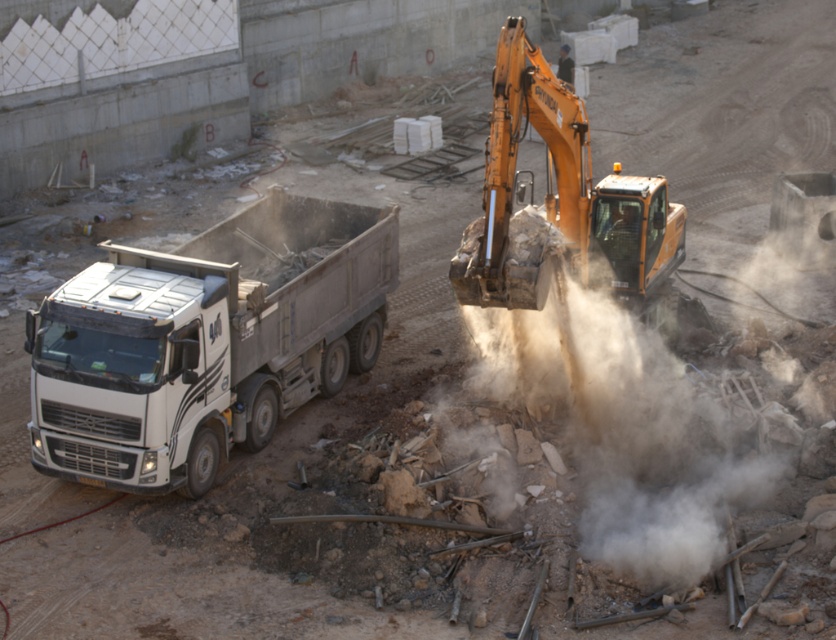
Between white metallic truck at left and brown dusty debris at center, which one appears on the left side from the viewer's perspective?

white metallic truck at left is more to the left.

Can you confirm if white metallic truck at left is positioned to the left of brown dusty debris at center?

Correct, you'll find white metallic truck at left to the left of brown dusty debris at center.

Is point (120, 481) behind point (599, 396)?

No, it is not.

This screenshot has width=836, height=640. I want to click on white metallic truck at left, so click(206, 340).

Which is behind, point (49, 436) or point (511, 35)?

The point (511, 35) is more distant.

Who is more forward, (264, 324) or (628, 195)?

Point (264, 324) is in front.

I want to click on white metallic truck at left, so click(x=206, y=340).

The width and height of the screenshot is (836, 640). Identify the location of white metallic truck at left. (206, 340).

Can you confirm if brown dusty debris at center is shorter than orange metallic excavator at upper right?

Incorrect, brown dusty debris at center's height does not fall short of orange metallic excavator at upper right's.

Is brown dusty debris at center smaller than orange metallic excavator at upper right?

No.

Where is `brown dusty debris at center`? brown dusty debris at center is located at coordinates click(650, 451).